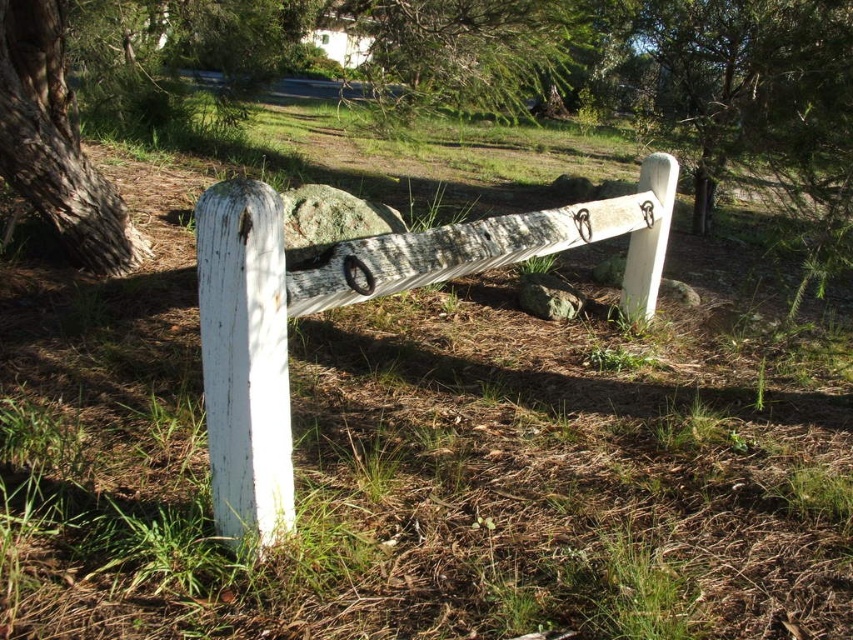
Who is positioned more to the left, white weathered wood fence at center or green textured tree at upper center?

green textured tree at upper center

Does point (260, 432) come in front of point (479, 104)?

That is True.

This screenshot has width=853, height=640. Identify the location of white weathered wood fence at center. (357, 301).

Which is more to the right, white weathered wood post at center or green textured tree at upper center?

green textured tree at upper center

Does white weathered wood post at center lie behind green textured tree at upper center?

That is False.

Identify the location of white weathered wood post at center. (245, 360).

Can you confirm if white wood tree at center is wider than gray bark tree at left?

Indeed, white wood tree at center has a greater width compared to gray bark tree at left.

Looking at this image, which is more to the right, white wood tree at center or gray bark tree at left?

From the viewer's perspective, white wood tree at center appears more on the right side.

Image resolution: width=853 pixels, height=640 pixels. What do you see at coordinates (459, 83) in the screenshot? I see `white wood tree at center` at bounding box center [459, 83].

At what (x,y) coordinates should I click in order to perform the action: click on white wood tree at center. Please return your answer as a coordinate pair (x, y). Looking at the image, I should click on (459, 83).